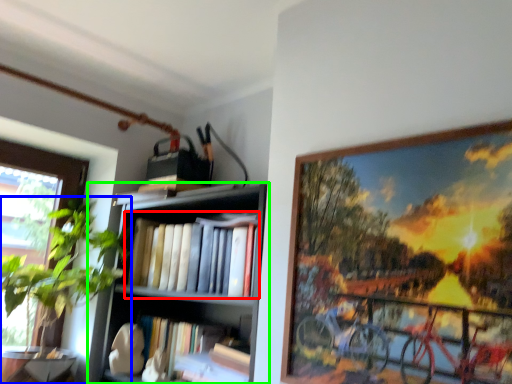
Question: Estimate the real-world distances between objects in this image. Which object is closer to book (highlighted by a red box), houseplant (highlighted by a blue box) or shelf (highlighted by a green box)?

Choices:
 (A) houseplant
 (B) shelf

Answer: (B)